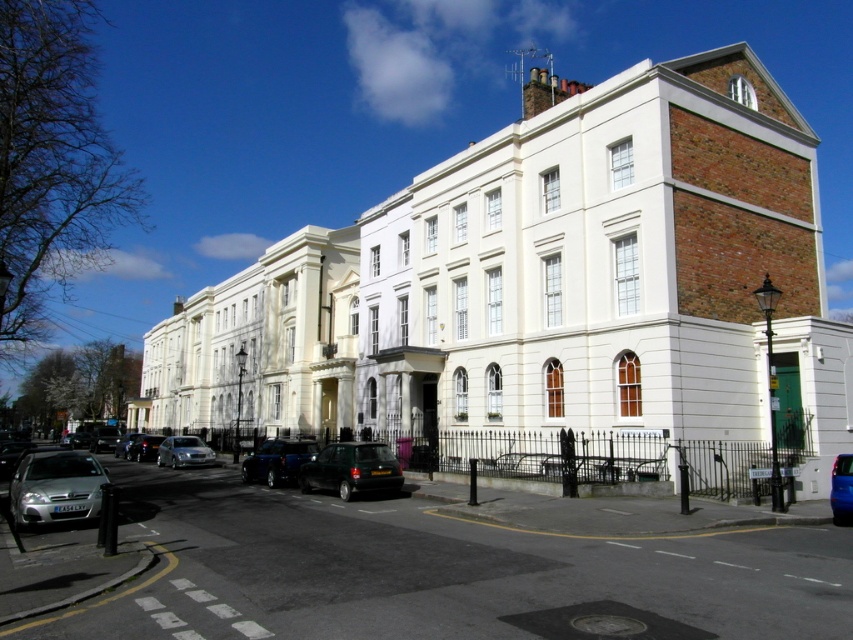
Question: Based on their relative distances, which object is nearer to the dark green matte car at center?

Choices:
 (A) shiny silver car at lower left
 (B) shiny black suv at center

Answer: (B)

Question: Does silver metallic car at lower left have a greater width compared to shiny blue car at center?

Choices:
 (A) no
 (B) yes

Answer: (B)

Question: Among these objects, which one is farthest from the camera?

Choices:
 (A) shiny blue car at center
 (B) silver metallic car at lower left

Answer: (A)

Question: Which object is closer to the camera taking this photo?

Choices:
 (A) shiny blue car at center
 (B) silver metallic car at lower left
 (C) shiny silver car at lower left

Answer: (B)

Question: From the image, what is the correct spatial relationship of dark green matte car at center in relation to shiny blue car at center?

Choices:
 (A) left
 (B) right

Answer: (A)

Question: Is dark green matte car at center in front of satin silver car at center?

Choices:
 (A) yes
 (B) no

Answer: (A)